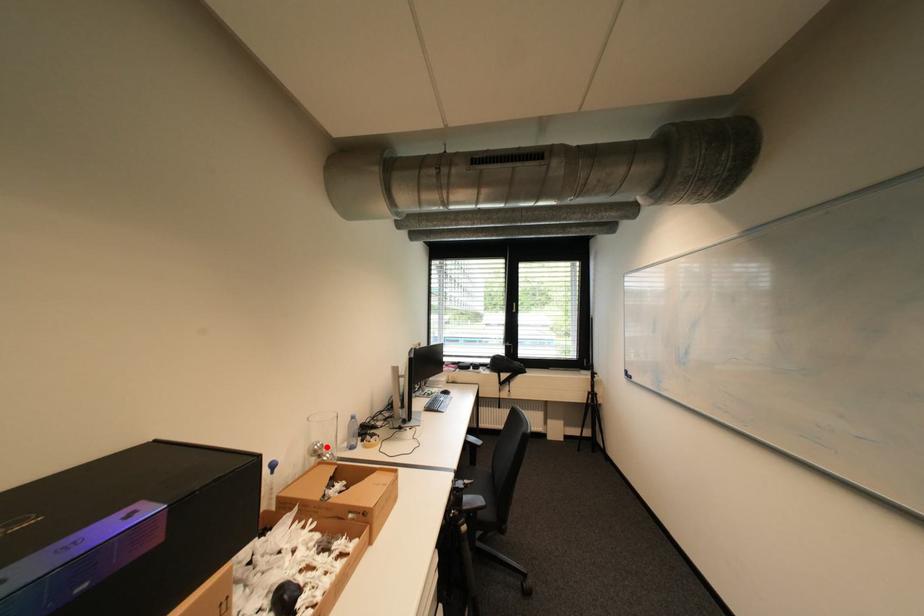
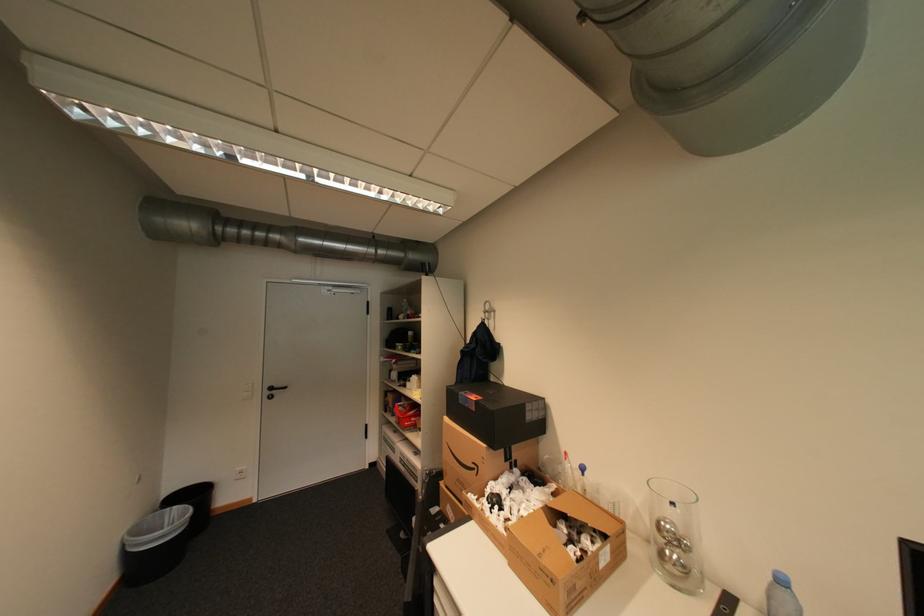
Locate, in the second image, the point that corresponds to the highlighted location in the first image.

(673, 527)